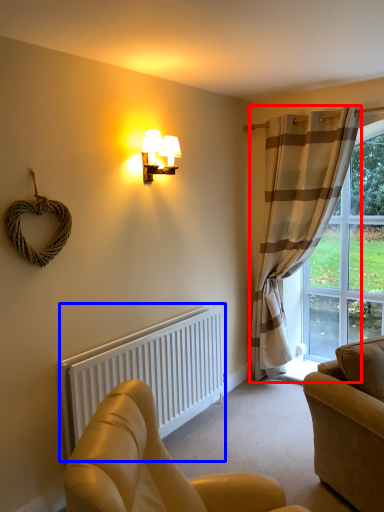
Question: Which point is closer to the camera, curtain (highlighted by a red box) or radiator (highlighted by a blue box)?

Choices:
 (A) curtain
 (B) radiator

Answer: (B)